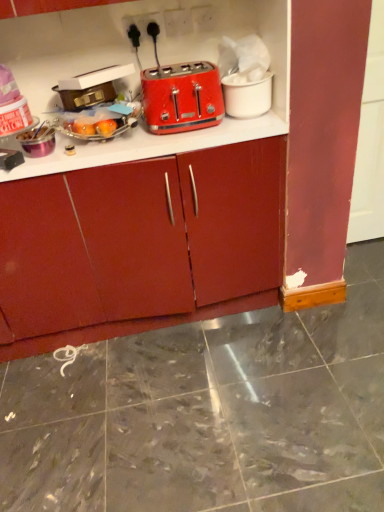
Find the location of a particular element. This screenshot has width=384, height=512. white matte cup at upper right, which is the first appliance in right-to-left order is located at coordinates (247, 95).

The height and width of the screenshot is (512, 384). What do you see at coordinates (140, 245) in the screenshot?
I see `matte red cabinet at center` at bounding box center [140, 245].

Identify the location of white matte cup at upper right, which is the first appliance in right-to-left order. Image resolution: width=384 pixels, height=512 pixels. (247, 95).

Which is behind, point (99, 103) or point (218, 103)?

Point (218, 103)

From the image's perspective, which one is positioned lower, metallic gold suitcase at upper left, the first appliance positioned from the left, or matte plastic toaster at upper center?

metallic gold suitcase at upper left, the first appliance positioned from the left, from the image's perspective.

Could matte plastic toaster at upper center be considered to be inside metallic gold suitcase at upper left, placed as the 2th appliance when sorted from right to left?

No, matte plastic toaster at upper center is not surrounded by metallic gold suitcase at upper left, placed as the 2th appliance when sorted from right to left.

In order to click on toaster on the right of metallic gold suitcase at upper left, placed as the 2th appliance when sorted from right to left in this screenshot , I will do `click(182, 97)`.

Considering the positions of objects matte red cabinet at center and metallic gold suitcase at upper left, placed as the 2th appliance when sorted from right to left, in the image provided, who is more to the right, matte red cabinet at center or metallic gold suitcase at upper left, placed as the 2th appliance when sorted from right to left,?

matte red cabinet at center.

Is matte red cabinet at center taller than metallic gold suitcase at upper left, the first appliance positioned from the left?

Correct, matte red cabinet at center is much taller as metallic gold suitcase at upper left, the first appliance positioned from the left.

From a real-world perspective, between white matte cup at upper right, which is the first appliance in right-to-left order, and matte plastic toaster at upper center, who is vertically lower?

In real-world perspective, white matte cup at upper right, which is the first appliance in right-to-left order, is lower.

This screenshot has height=512, width=384. Find the location of `toaster on the left side of white matte cup at upper right, placed as the 2th appliance when sorted from left to right`. toaster on the left side of white matte cup at upper right, placed as the 2th appliance when sorted from left to right is located at coordinates (182, 97).

Between white matte cup at upper right, which is the first appliance in right-to-left order, and matte plastic toaster at upper center, which one is positioned behind?

white matte cup at upper right, which is the first appliance in right-to-left order, is further from the camera.

Between white matte cup at upper right, which is the first appliance in right-to-left order, and matte plastic toaster at upper center, which one has larger width?

Wider between the two is white matte cup at upper right, which is the first appliance in right-to-left order.

Is white matte cup at upper right, placed as the 2th appliance when sorted from left to right, at the right side of metallic gold suitcase at upper left, the first appliance positioned from the left?

Yes.

Consider the image. From a real-world perspective, is white matte cup at upper right, which is the first appliance in right-to-left order, below metallic gold suitcase at upper left, the first appliance positioned from the left?

Yes, from a real-world perspective, white matte cup at upper right, which is the first appliance in right-to-left order, is under metallic gold suitcase at upper left, the first appliance positioned from the left.

Could you tell me if white matte cup at upper right, placed as the 2th appliance when sorted from left to right, is facing metallic gold suitcase at upper left, the first appliance positioned from the left?

No, white matte cup at upper right, placed as the 2th appliance when sorted from left to right, is not aimed at metallic gold suitcase at upper left, the first appliance positioned from the left.

How different are the orientations of matte red cabinet at center and white matte cup at upper right, placed as the 2th appliance when sorted from left to right, in degrees?

5.52 degrees.

Can you confirm if matte red cabinet at center is thinner than white matte cup at upper right, placed as the 2th appliance when sorted from left to right?

No.

Measure the distance from matte red cabinet at center to white matte cup at upper right, which is the first appliance in right-to-left order.

matte red cabinet at center and white matte cup at upper right, which is the first appliance in right-to-left order, are 22.93 inches apart from each other.

Considering the relative sizes of matte red cabinet at center and white matte cup at upper right, placed as the 2th appliance when sorted from left to right, in the image provided, is matte red cabinet at center taller than white matte cup at upper right, placed as the 2th appliance when sorted from left to right,?

Indeed, matte red cabinet at center has a greater height compared to white matte cup at upper right, placed as the 2th appliance when sorted from left to right.

Does metallic gold suitcase at upper left, the first appliance positioned from the left, turn towards white matte cup at upper right, placed as the 2th appliance when sorted from left to right?

No, metallic gold suitcase at upper left, the first appliance positioned from the left, is not aimed at white matte cup at upper right, placed as the 2th appliance when sorted from left to right.

Based on their sizes in the image, would you say metallic gold suitcase at upper left, the first appliance positioned from the left, is bigger or smaller than white matte cup at upper right, placed as the 2th appliance when sorted from left to right?

Considering their sizes, metallic gold suitcase at upper left, the first appliance positioned from the left, takes up less space than white matte cup at upper right, placed as the 2th appliance when sorted from left to right.

Based on the photo, from a real-world perspective, is metallic gold suitcase at upper left, placed as the 2th appliance when sorted from right to left, physically located above or below white matte cup at upper right, which is the first appliance in right-to-left order?

metallic gold suitcase at upper left, placed as the 2th appliance when sorted from right to left, is situated higher than white matte cup at upper right, which is the first appliance in right-to-left order, in the real world.

From the image's perspective, between metallic gold suitcase at upper left, the first appliance positioned from the left, and white matte cup at upper right, which is the first appliance in right-to-left order, which one is located above?

From the image's view, white matte cup at upper right, which is the first appliance in right-to-left order, is above.

How much distance is there between white matte cup at upper right, which is the first appliance in right-to-left order, and matte red cabinet at center?

22.93 inches.

Which is nearer, [250,97] or [9,306]?

The point [250,97] is more forward.

Between white matte cup at upper right, which is the first appliance in right-to-left order, and matte red cabinet at center, which one appears on the left side from the viewer's perspective?

Positioned to the left is matte red cabinet at center.

Consider the image. Is white matte cup at upper right, placed as the 2th appliance when sorted from left to right, turned away from matte red cabinet at center?

white matte cup at upper right, placed as the 2th appliance when sorted from left to right, does not have its back to matte red cabinet at center.

The height and width of the screenshot is (512, 384). In the image, there is a matte plastic toaster at upper center. Identify the location of appliance below it (from the image's perspective). (86, 96).

Where is `appliance on the left side of matte red cabinet at center`? The height and width of the screenshot is (512, 384). appliance on the left side of matte red cabinet at center is located at coordinates (86, 96).

When comparing their distances from matte red cabinet at center, does metallic gold suitcase at upper left, placed as the 2th appliance when sorted from right to left, or matte plastic toaster at upper center seem further?

metallic gold suitcase at upper left, placed as the 2th appliance when sorted from right to left, is positioned further to the anchor matte red cabinet at center.

Estimate the real-world distances between objects in this image. Which object is closer to metallic gold suitcase at upper left, placed as the 2th appliance when sorted from right to left, matte plastic toaster at upper center or matte red cabinet at center?

matte plastic toaster at upper center.

When comparing their distances from matte red cabinet at center, does metallic gold suitcase at upper left, the first appliance positioned from the left, or white matte cup at upper right, placed as the 2th appliance when sorted from left to right, seem closer?

white matte cup at upper right, placed as the 2th appliance when sorted from left to right, is positioned closer to the anchor matte red cabinet at center.

Based on the photo, estimate the real-world distances between objects in this image. Which object is further from metallic gold suitcase at upper left, the first appliance positioned from the left, white matte cup at upper right, which is the first appliance in right-to-left order, or matte plastic toaster at upper center?

white matte cup at upper right, which is the first appliance in right-to-left order, is positioned further to the anchor metallic gold suitcase at upper left, the first appliance positioned from the left.

Which object lies nearer to the anchor point matte plastic toaster at upper center, matte red cabinet at center or white matte cup at upper right, placed as the 2th appliance when sorted from left to right?

The object closer to matte plastic toaster at upper center is white matte cup at upper right, placed as the 2th appliance when sorted from left to right.

Estimate the real-world distances between objects in this image. Which object is further from matte plastic toaster at upper center, white matte cup at upper right, placed as the 2th appliance when sorted from left to right, or matte red cabinet at center?

Among the two, matte red cabinet at center is located further to matte plastic toaster at upper center.

When comparing their distances from white matte cup at upper right, which is the first appliance in right-to-left order, does matte red cabinet at center or matte plastic toaster at upper center seem closer?

matte plastic toaster at upper center is closer to white matte cup at upper right, which is the first appliance in right-to-left order.

Which object lies nearer to the anchor point white matte cup at upper right, placed as the 2th appliance when sorted from left to right, metallic gold suitcase at upper left, placed as the 2th appliance when sorted from right to left, or matte plastic toaster at upper center?

Among the two, matte plastic toaster at upper center is located nearer to white matte cup at upper right, placed as the 2th appliance when sorted from left to right.

This screenshot has width=384, height=512. In order to click on toaster between metallic gold suitcase at upper left, placed as the 2th appliance when sorted from right to left, and white matte cup at upper right, placed as the 2th appliance when sorted from left to right, from left to right in this screenshot , I will do `click(182, 97)`.

Where is `appliance that lies between white matte cup at upper right, which is the first appliance in right-to-left order, and matte red cabinet at center from top to bottom`? This screenshot has width=384, height=512. appliance that lies between white matte cup at upper right, which is the first appliance in right-to-left order, and matte red cabinet at center from top to bottom is located at coordinates (86, 96).

Locate an element on the screen. The image size is (384, 512). appliance between matte plastic toaster at upper center and matte red cabinet at center in the up-down direction is located at coordinates (86, 96).

The width and height of the screenshot is (384, 512). Identify the location of toaster between white matte cup at upper right, which is the first appliance in right-to-left order, and matte red cabinet at center, in the vertical direction. (182, 97).